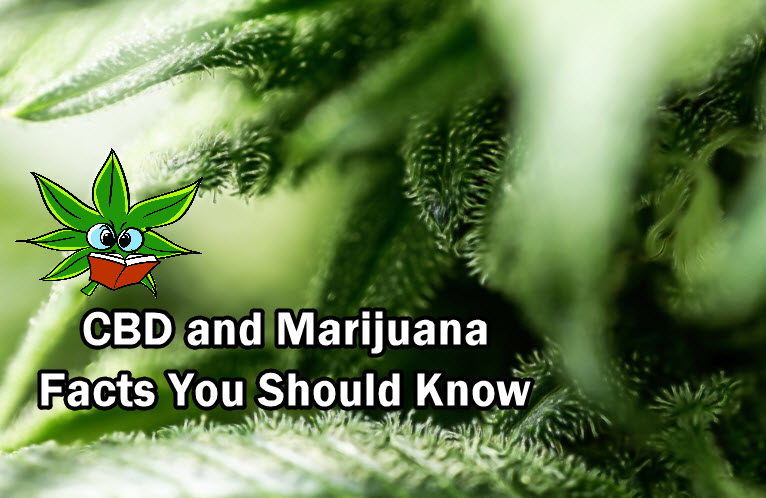
Where is `open book`? This screenshot has height=498, width=766. open book is located at coordinates (119, 274).